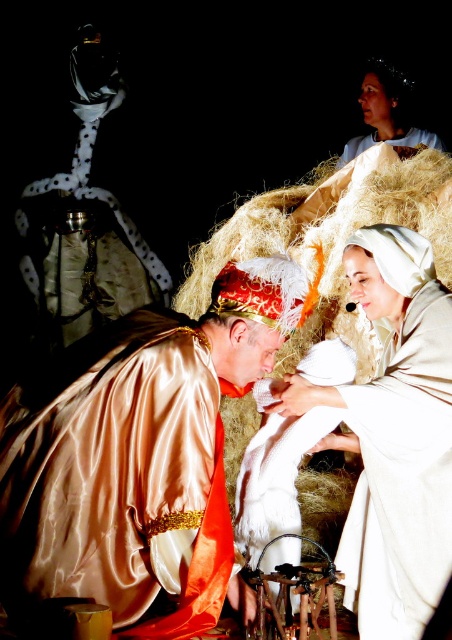
Consider the image. Which is more to the left, satin gold robe at center or white linen cloth at center?

satin gold robe at center

Is point (70, 515) positioned before point (380, 520)?

Yes, point (70, 515) is in front of point (380, 520).

At what (x,y) coordinates should I click in order to perform the action: click on satin gold robe at center. Please return your answer as a coordinate pair (x, y). This screenshot has height=640, width=452. Looking at the image, I should click on (139, 454).

Is satin gold robe at center above white cotton robe at upper center?

No.

Which is behind, point (137, 611) or point (414, 128)?

Point (414, 128)

Identify the location of satin gold robe at center. (139, 454).

In the scene shown: Measure the distance from white linen cloth at center to smooth white cloth at upper center.

They are 21.68 meters apart.

Between point (438, 488) and point (404, 147), which one is positioned in front?

Point (438, 488) is in front.

Image resolution: width=452 pixels, height=640 pixels. I want to click on white linen cloth at center, so click(394, 436).